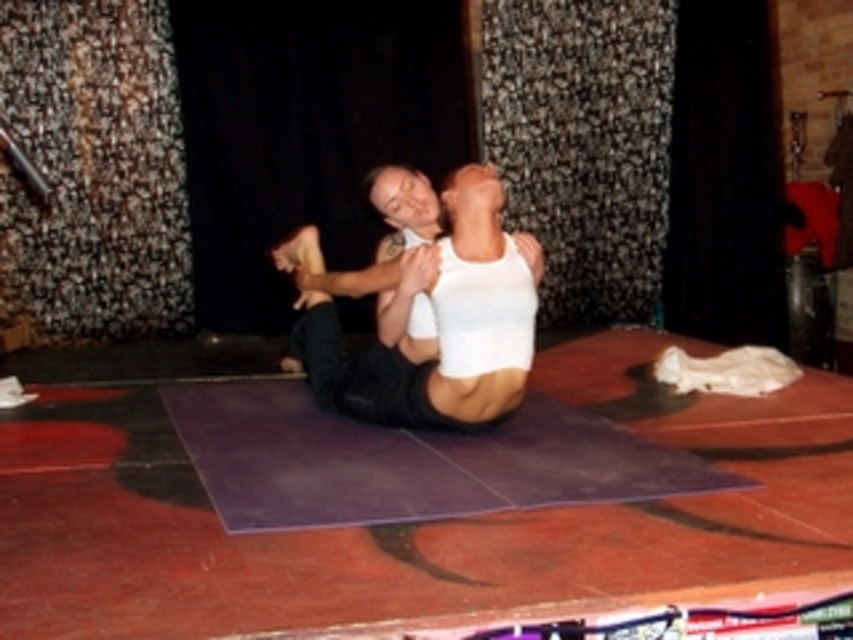
Question: Which point is farther to the camera?

Choices:
 (A) (241, 426)
 (B) (343, 280)

Answer: (A)

Question: Where is purple rubber mat at center located in relation to white matte tank top at center in the image?

Choices:
 (A) right
 (B) left

Answer: (B)

Question: Can you confirm if purple rubber mat at center is smaller than white matte tank top at center?

Choices:
 (A) yes
 (B) no

Answer: (B)

Question: Which point is farther to the camera?

Choices:
 (A) (605, 488)
 (B) (474, 264)

Answer: (B)

Question: Is purple rubber mat at center to the left of white matte tank top at center from the viewer's perspective?

Choices:
 (A) no
 (B) yes

Answer: (B)